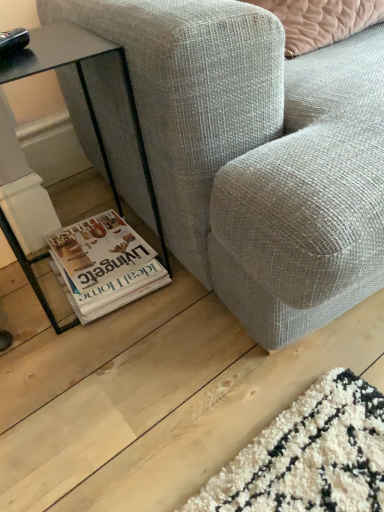
Where is `free location in front of white glossy magazine at lower left`? free location in front of white glossy magazine at lower left is located at coordinates (99, 348).